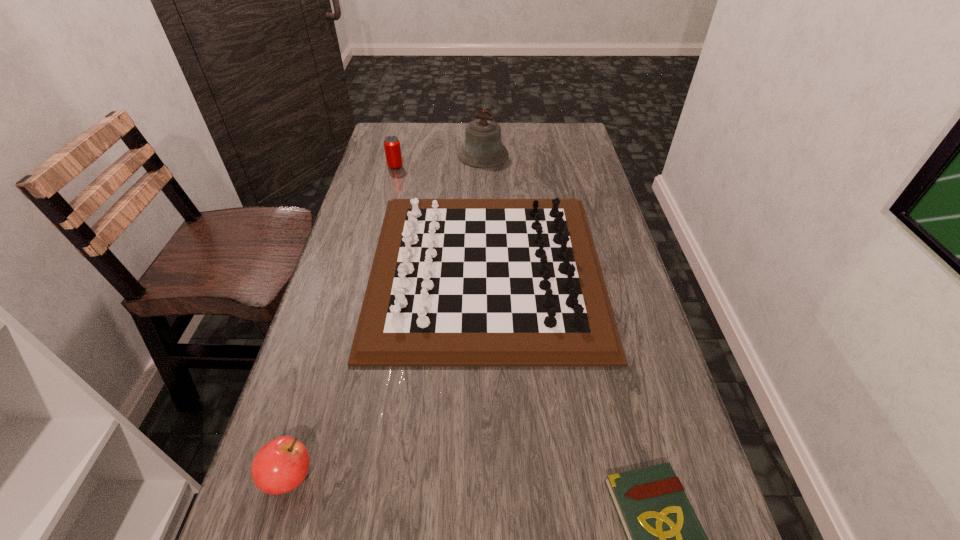
The width and height of the screenshot is (960, 540). Identify the location of object that is the third closest to the book. (483, 148).

The width and height of the screenshot is (960, 540). Find the location of `the fourth closest object to the bell`. the fourth closest object to the bell is located at coordinates pos(665,539).

The height and width of the screenshot is (540, 960). Find the location of `vacant region that satisfies the following two spatial constraints: 1. on the back side of the apple; 2. on the left side of the tallest object`. vacant region that satisfies the following two spatial constraints: 1. on the back side of the apple; 2. on the left side of the tallest object is located at coordinates (385, 155).